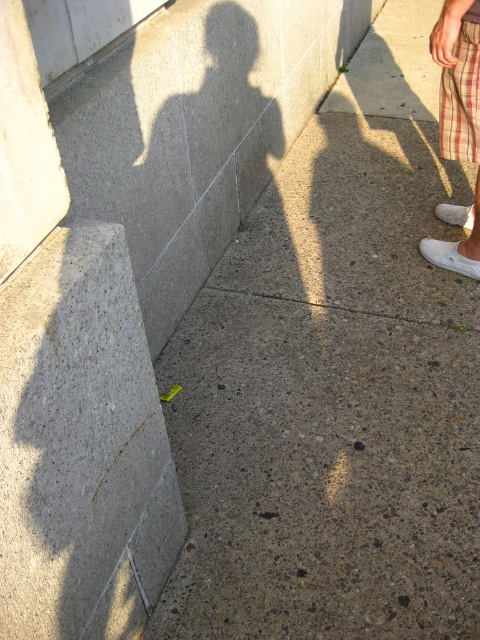
Question: Is gray concrete pavement at lower left smaller than plaid fabric at right?

Choices:
 (A) yes
 (B) no

Answer: (B)

Question: Does gray concrete wall at left have a smaller size compared to white fabric shorts at lower right?

Choices:
 (A) yes
 (B) no

Answer: (A)

Question: Which object appears closest to the camera in this image?

Choices:
 (A) white fabric shoe at lower right
 (B) plaid fabric at right
 (C) gray concrete pavement at lower left

Answer: (C)

Question: Among these objects, which one is farthest from the camera?

Choices:
 (A) white matte shoe at right
 (B) white fabric shoe at lower right

Answer: (A)

Question: Among these objects, which one is nearest to the camera?

Choices:
 (A) white fabric shorts at lower right
 (B) white fabric shoe at lower right
 (C) gray concrete pavement at lower left

Answer: (C)

Question: Can you confirm if white fabric shoe at lower right is positioned to the left of white matte shoe at right?

Choices:
 (A) yes
 (B) no

Answer: (A)